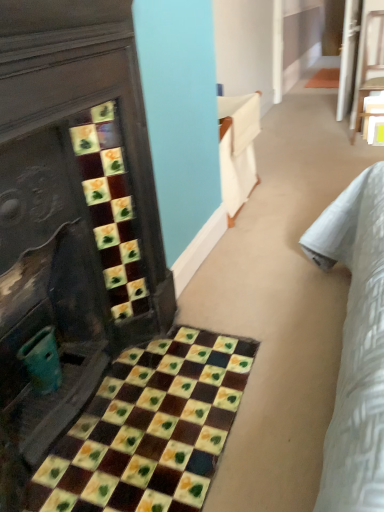
Question: Can you confirm if multicolored mosaic tiles at lower left is taller than wooden chair at upper right?

Choices:
 (A) no
 (B) yes

Answer: (A)

Question: Considering the relative sizes of multicolored mosaic tiles at lower left and wooden chair at upper right in the image provided, is multicolored mosaic tiles at lower left wider than wooden chair at upper right?

Choices:
 (A) yes
 (B) no

Answer: (A)

Question: Does multicolored mosaic tiles at lower left appear on the right side of wooden chair at upper right?

Choices:
 (A) no
 (B) yes

Answer: (A)

Question: Is multicolored mosaic tiles at lower left in front of wooden chair at upper right?

Choices:
 (A) no
 (B) yes

Answer: (B)

Question: From the image's perspective, does multicolored mosaic tiles at lower left appear lower than wooden chair at upper right?

Choices:
 (A) yes
 (B) no

Answer: (A)

Question: Is multicolored mosaic tiles at lower left bigger or smaller than teal plastic cup at lower left?

Choices:
 (A) big
 (B) small

Answer: (A)

Question: From a real-world perspective, is multicolored mosaic tiles at lower left positioned above or below teal plastic cup at lower left?

Choices:
 (A) above
 (B) below

Answer: (B)

Question: Is point (147, 504) positioned closer to the camera than point (52, 356)?

Choices:
 (A) closer
 (B) farther

Answer: (A)

Question: Is multicolored mosaic tiles at lower left wider or thinner than teal plastic cup at lower left?

Choices:
 (A) thin
 (B) wide

Answer: (B)

Question: Based on their positions, is yellow matte square at center located to the left or right of wooden chair at upper right?

Choices:
 (A) left
 (B) right

Answer: (B)

Question: Considering the positions of point (367, 139) and point (369, 28), is point (367, 139) closer or farther from the camera than point (369, 28)?

Choices:
 (A) closer
 (B) farther

Answer: (B)

Question: Considering the positions of yellow matte square at center and wooden chair at upper right in the image, is yellow matte square at center taller or shorter than wooden chair at upper right?

Choices:
 (A) short
 (B) tall

Answer: (A)

Question: Looking at their shapes, would you say yellow matte square at center is wider or thinner than wooden chair at upper right?

Choices:
 (A) thin
 (B) wide

Answer: (A)

Question: Considering the positions of wooden chair at upper right and teal plastic cup at lower left in the image, is wooden chair at upper right taller or shorter than teal plastic cup at lower left?

Choices:
 (A) short
 (B) tall

Answer: (B)

Question: Visually, is wooden chair at upper right positioned to the left or to the right of teal plastic cup at lower left?

Choices:
 (A) right
 (B) left

Answer: (A)